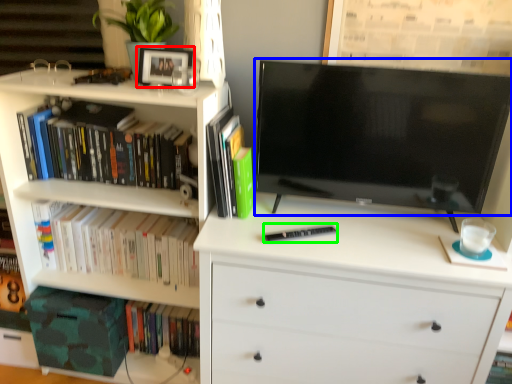
Question: Considering the real-world distances, which object is closest to picture frame (highlighted by a red box)? television (highlighted by a blue box) or paperback book (highlighted by a green box).

Choices:
 (A) television
 (B) paperback book

Answer: (A)